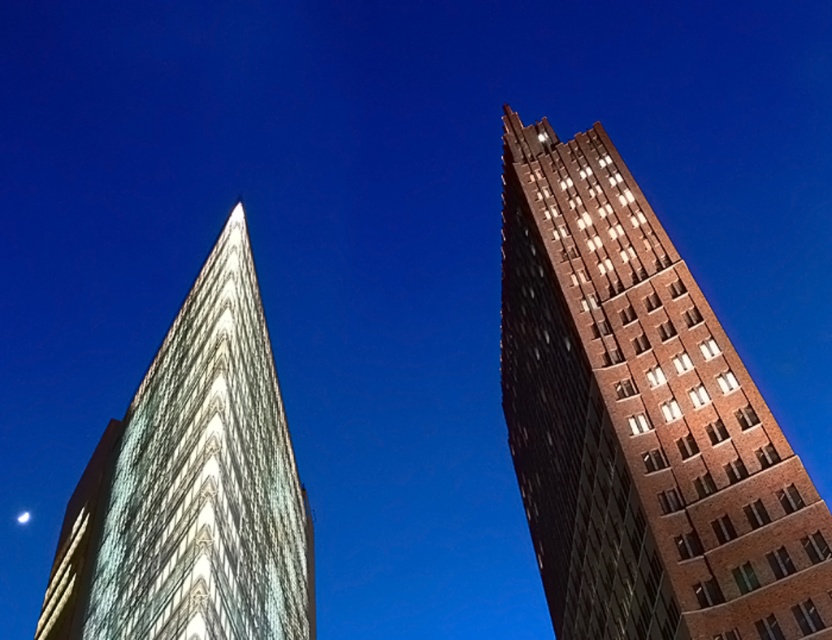
Is brown brick building at upper right thinner than white glass building at left?

Indeed, brown brick building at upper right has a lesser width compared to white glass building at left.

Who is positioned more to the left, brown brick building at upper right or white glass building at left?

white glass building at left

The width and height of the screenshot is (832, 640). In order to click on brown brick building at upper right in this screenshot , I will do `click(640, 420)`.

Where is `brown brick building at upper right`? This screenshot has width=832, height=640. brown brick building at upper right is located at coordinates (640, 420).